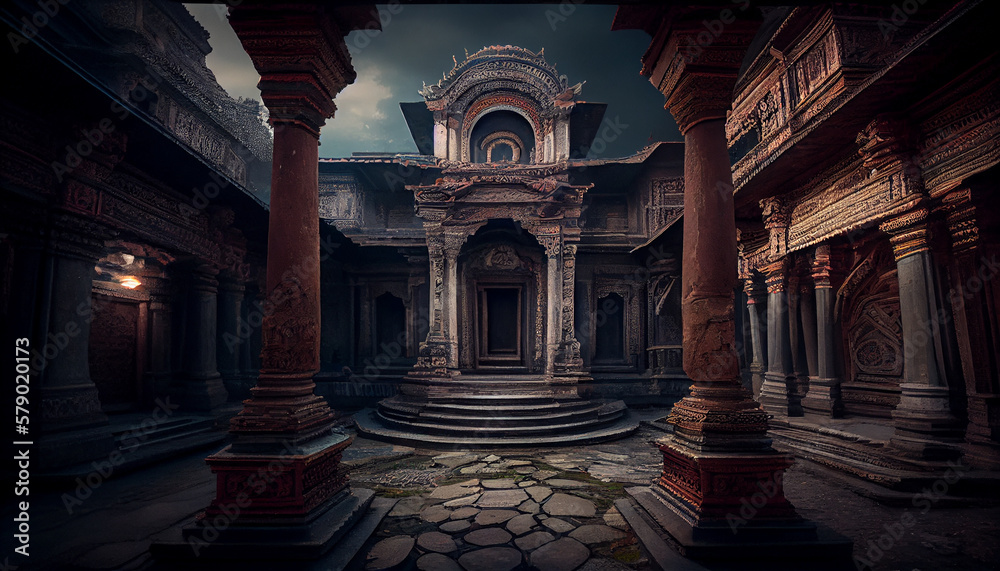
The height and width of the screenshot is (571, 1000). Find the location of `stairs in center`. stairs in center is located at coordinates (493, 438), (494, 422), (492, 400).